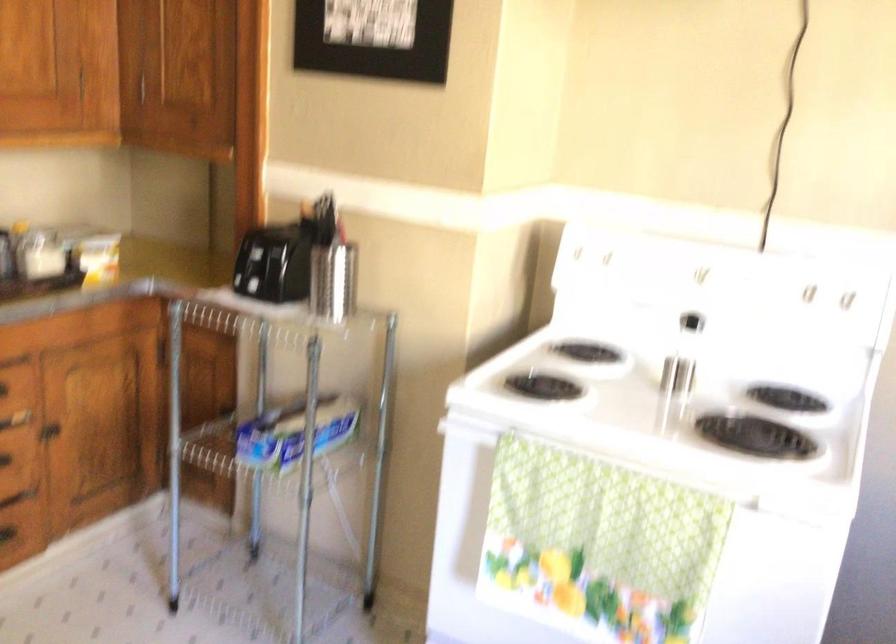
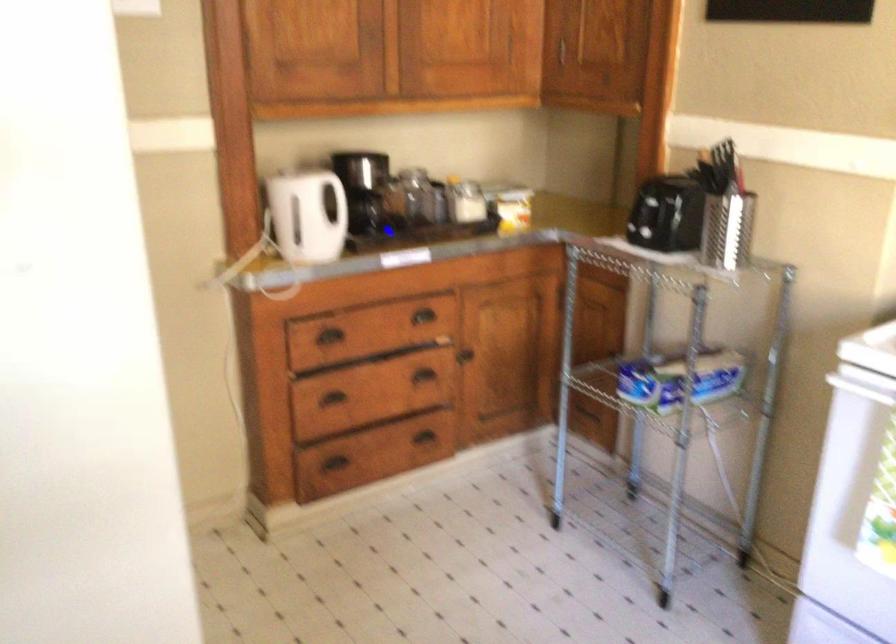
Which direction would the cameraman need to move to produce the second image?

The movement direction of the cameraman is right, backward.